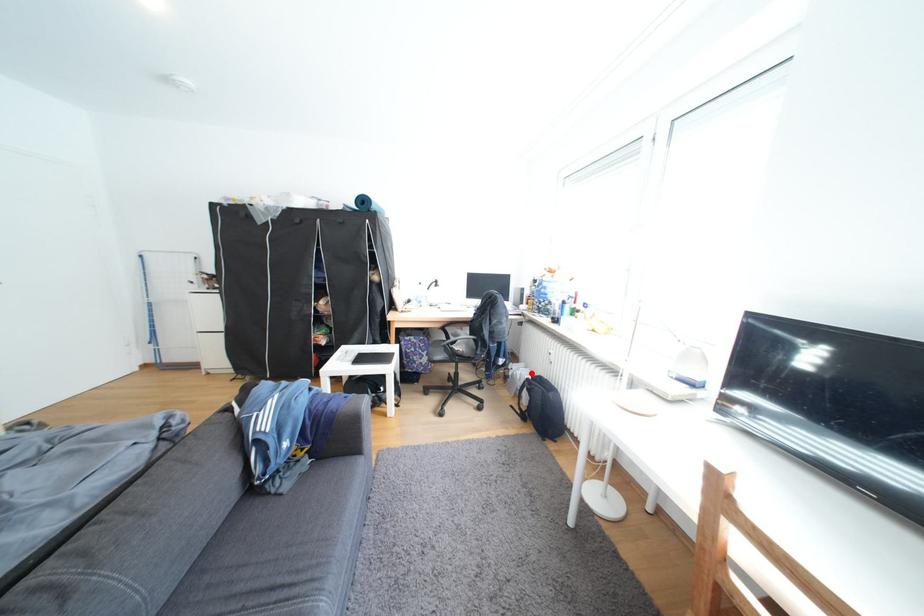
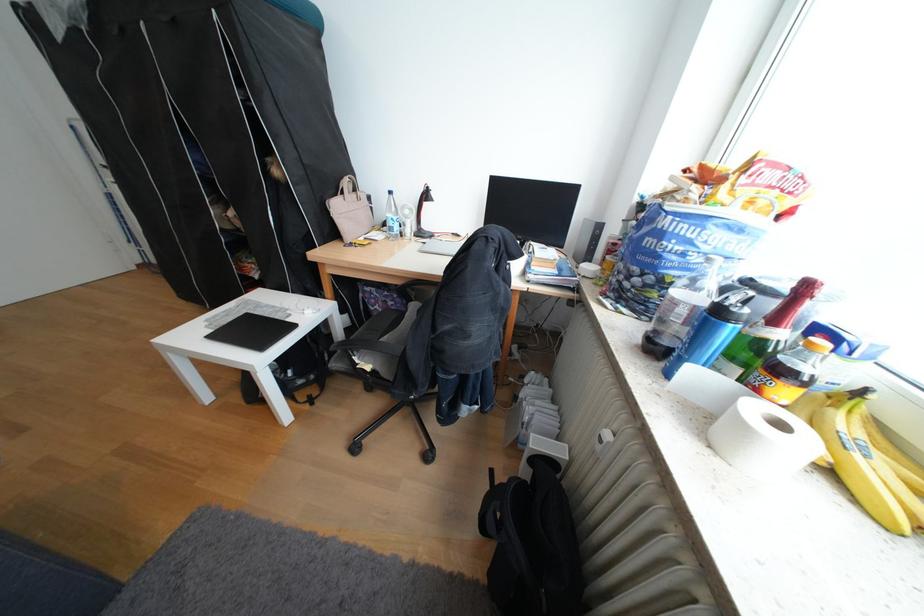
In the second image, find the point that corresponds to the highlighted location in the first image.

(541, 410)